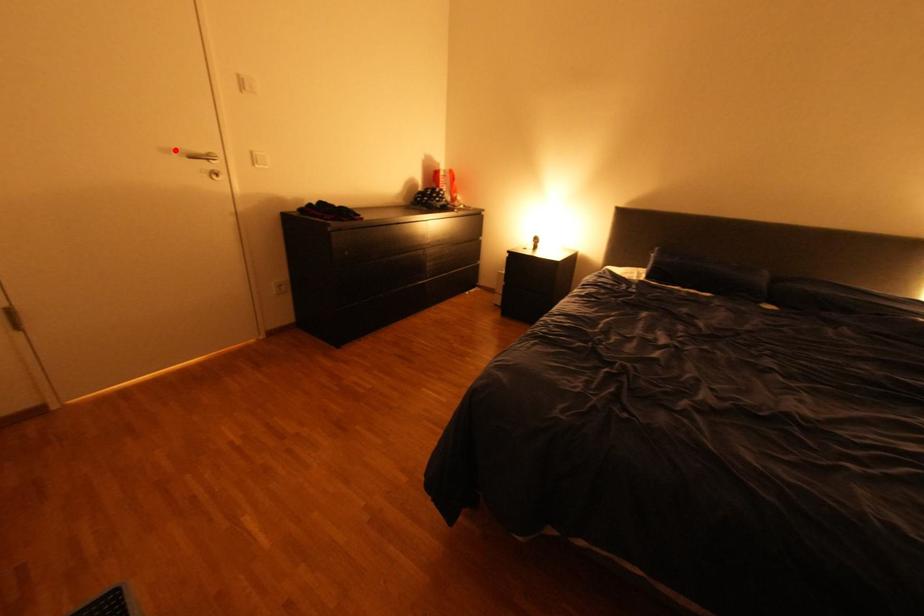
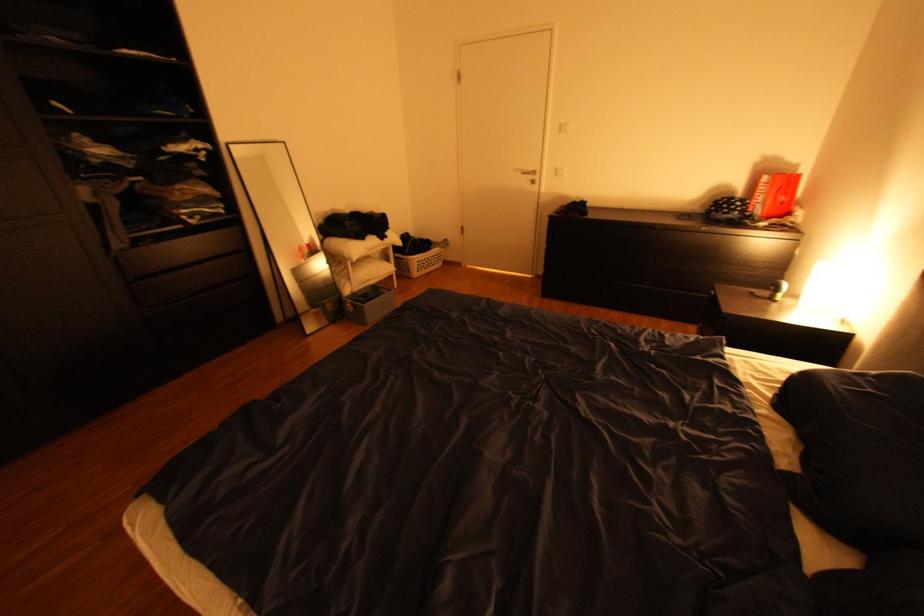
Question: I am providing you with two images of the same scene from different viewpoints. A red point is shown in image1. For the corresponding object point in image2, is it positioned nearer or farther from the camera?

Choices:
 (A) Nearer
 (B) Farther

Answer: (A)